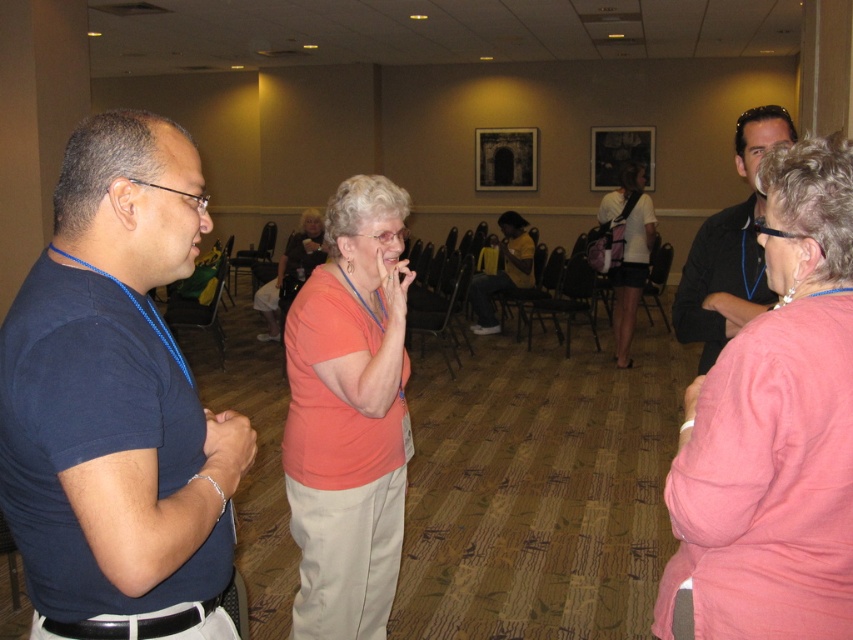
You are organizing a space for a group activity and need to place the pink fabric backpack at center and the orange matte shirt at center on a shelf. If the shelf has limited space, which item should you place first to ensure both fit?

Since the pink fabric backpack at center takes up less space than the orange matte shirt at center, you should place the orange matte shirt at center first to accommodate its larger size, then fit the pink fabric backpack at center next to it.